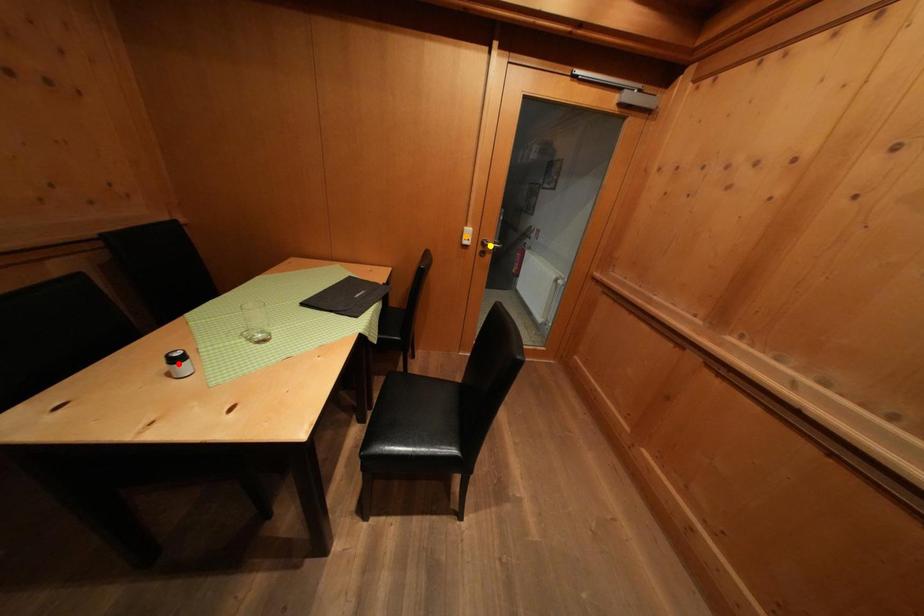
Based on the photo, order these from nearest to farthest:
A) orange point
B) yellow point
C) red point

1. red point
2. orange point
3. yellow point